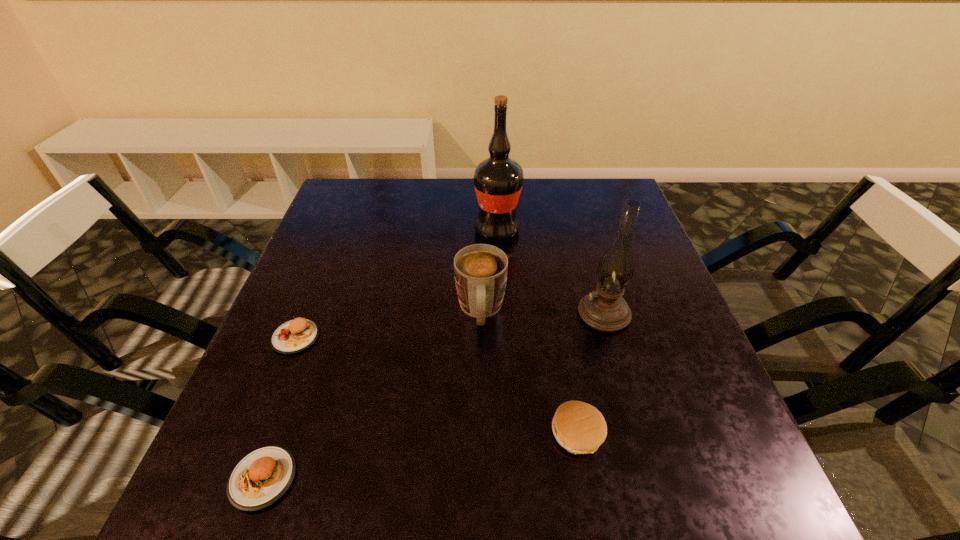
Where is `free area in between the shortest food and the second object from right to left`? free area in between the shortest food and the second object from right to left is located at coordinates (420, 456).

This screenshot has width=960, height=540. I want to click on free space between the rightmost food and the farthest food, so click(x=437, y=385).

Image resolution: width=960 pixels, height=540 pixels. Find the location of `empty location between the oil lamp and the tallest object`. empty location between the oil lamp and the tallest object is located at coordinates (550, 272).

I want to click on vacant area that lies between the mug and the farthest food, so click(388, 324).

Find the location of a particular element. The height and width of the screenshot is (540, 960). object that is the third nearest to the tallest object is located at coordinates (293, 336).

Identify the location of object that ranks as the closest to the tallest object. (480, 270).

Find the location of a particular element. The width and height of the screenshot is (960, 540). the second closest food to the tallest object is located at coordinates (580, 428).

In order to click on food that stands as the closest to the rightmost food in this screenshot , I will do `click(259, 479)`.

I want to click on blank area in the image that satisfies the following two spatial constraints: 1. on the front side of the farthest object; 2. on the right side of the rightmost object, so click(x=501, y=313).